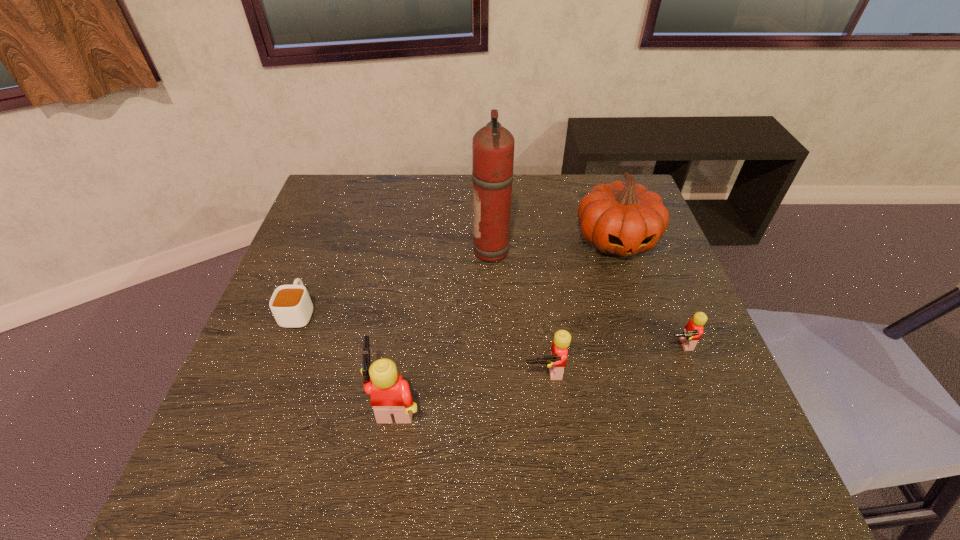
This screenshot has width=960, height=540. Identify the location of free area in between the tallest Lego and the pumpkin. (506, 320).

The height and width of the screenshot is (540, 960). In order to click on vacant area between the pumpkin and the second shortest object in this screenshot , I will do `click(647, 292)`.

Where is `vacant space that is in between the fifth object from right to left and the pumpkin`? This screenshot has width=960, height=540. vacant space that is in between the fifth object from right to left and the pumpkin is located at coordinates (506, 320).

Locate an element on the screen. The image size is (960, 540). unoccupied position between the fourth nearest object and the pumpkin is located at coordinates (458, 275).

Where is `free space between the fifth object from right to left and the fire extinguisher`? free space between the fifth object from right to left and the fire extinguisher is located at coordinates pyautogui.click(x=445, y=327).

Identify which object is the fourth closest to the pumpkin. Please provide its 2D coordinates. Your answer should be formatted as a tuple, i.e. [(x, y)], where the tuple contains the x and y coordinates of a point satisfying the conditions above.

[(390, 395)]

At what (x,y) coordinates should I click in order to perform the action: click on object that is the fourth nearest to the rightmost Lego. Please return your answer as a coordinate pair (x, y). Looking at the image, I should click on (390, 395).

Select which Lego is the closest to the second Lego from left to right. Please provide its 2D coordinates. Your answer should be formatted as a tuple, i.e. [(x, y)], where the tuple contains the x and y coordinates of a point satisfying the conditions above.

[(390, 395)]

The height and width of the screenshot is (540, 960). I want to click on Lego that stands as the third closest to the pumpkin, so click(x=390, y=395).

Find the location of a particular element. Image resolution: width=960 pixels, height=540 pixels. vacant region that satisfies the following two spatial constraints: 1. on the face of the pumpkin; 2. on the side of the fire extinguisher with the label and nozzle is located at coordinates (620, 252).